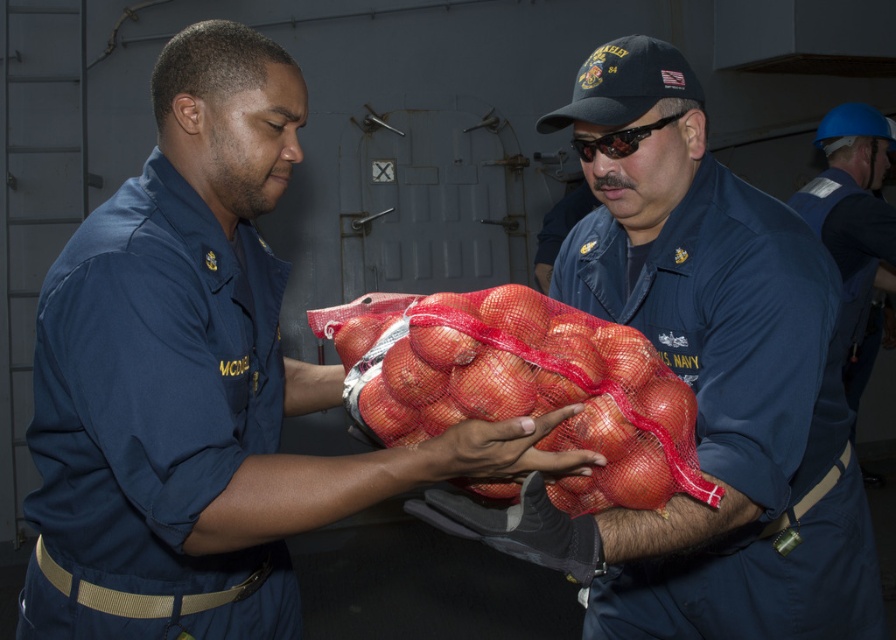
Does red mesh bag of onions at center have a lesser width compared to blue fabric uniform at right?

Yes, red mesh bag of onions at center is thinner than blue fabric uniform at right.

Which is more to the left, red mesh bag of onions at center or blue fabric uniform at right?

Positioned to the left is red mesh bag of onions at center.

The width and height of the screenshot is (896, 640). Describe the element at coordinates (521, 385) in the screenshot. I see `red mesh bag of onions at center` at that location.

You are a GUI agent. You are given a task and a screenshot of the screen. Output one action in this format:
    pyautogui.click(x=<x>, y=<y>)
    Task: Click on the red mesh bag of onions at center
    The image size is (896, 640).
    Given the screenshot: What is the action you would take?
    pyautogui.click(x=521, y=385)

Between blue uniform at center and blue fabric uniform at center, which one appears on the left side from the viewer's perspective?

blue uniform at center

Identify the location of blue uniform at center. Image resolution: width=896 pixels, height=640 pixels. (200, 381).

In order to click on blue uniform at center in this screenshot , I will do `click(200, 381)`.

Who is more forward, (54, 602) or (798, 577)?

Positioned in front is point (54, 602).

Who is shorter, navy blue fabric uniform at left or blue fabric uniform at center?

navy blue fabric uniform at left is shorter.

Locate an element on the screen. The height and width of the screenshot is (640, 896). navy blue fabric uniform at left is located at coordinates (153, 417).